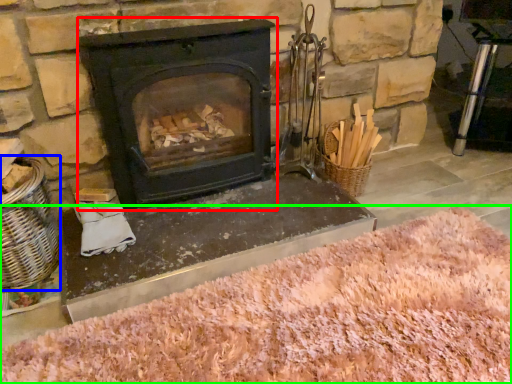
Question: Estimate the real-world distances between objects in this image. Which object is closer to wood burning stove (highlighted by a red box), basket (highlighted by a blue box) or sand (highlighted by a green box)?

Choices:
 (A) basket
 (B) sand

Answer: (A)